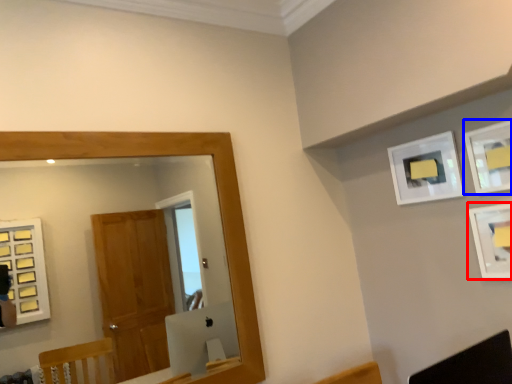
Question: Which of the following is the closest to the observer, picture frame (highlighted by a red box) or picture frame (highlighted by a blue box)?

Choices:
 (A) picture frame
 (B) picture frame

Answer: (A)